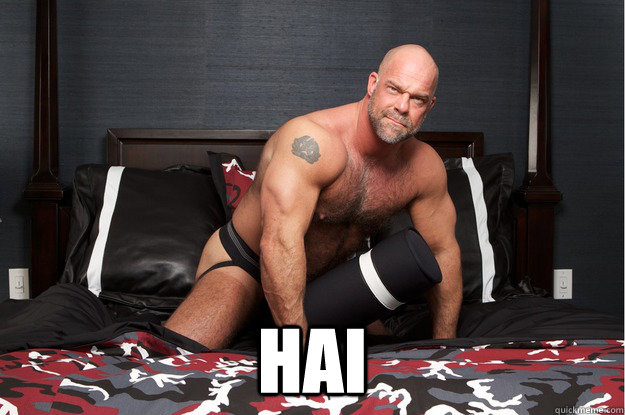
Where is `bedding`? bedding is located at coordinates (200, 385), (147, 225), (519, 310).